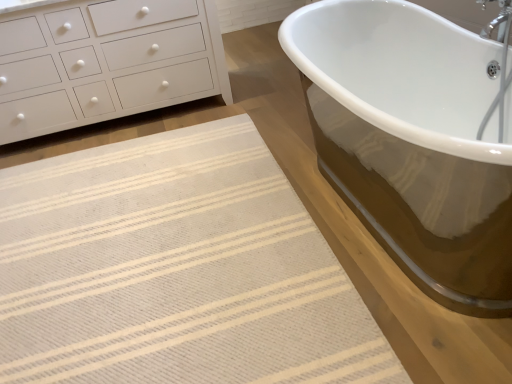
Question: Is beige woven rug at lower left completely or partially outside of white matte chest of drawers at upper left?

Choices:
 (A) yes
 (B) no

Answer: (A)

Question: Is beige woven rug at lower left thinner than white matte chest of drawers at upper left?

Choices:
 (A) yes
 (B) no

Answer: (B)

Question: Is beige woven rug at lower left directly adjacent to white matte chest of drawers at upper left?

Choices:
 (A) yes
 (B) no

Answer: (B)

Question: Is beige woven rug at lower left surrounding white matte chest of drawers at upper left?

Choices:
 (A) no
 (B) yes

Answer: (A)

Question: Is beige woven rug at lower left positioned in front of white matte chest of drawers at upper left?

Choices:
 (A) no
 (B) yes

Answer: (B)

Question: Does beige woven rug at lower left have a lesser height compared to white matte chest of drawers at upper left?

Choices:
 (A) yes
 (B) no

Answer: (A)

Question: Is beige woven rug at lower left at the back of white matte chest of drawers at upper left?

Choices:
 (A) yes
 (B) no

Answer: (B)

Question: Can you confirm if white matte chest of drawers at upper left is shorter than beige woven rug at lower left?

Choices:
 (A) yes
 (B) no

Answer: (B)

Question: Does white matte chest of drawers at upper left have a lesser width compared to beige woven rug at lower left?

Choices:
 (A) yes
 (B) no

Answer: (A)

Question: Could you tell me if white matte chest of drawers at upper left is facing beige woven rug at lower left?

Choices:
 (A) no
 (B) yes

Answer: (B)

Question: Does white matte chest of drawers at upper left lie in front of beige woven rug at lower left?

Choices:
 (A) no
 (B) yes

Answer: (A)

Question: From a real-world perspective, does white matte chest of drawers at upper left sit lower than beige woven rug at lower left?

Choices:
 (A) no
 (B) yes

Answer: (A)

Question: From the image's perspective, relative to beige woven rug at lower left, is white matte chest of drawers at upper left above or below?

Choices:
 (A) below
 (B) above

Answer: (B)